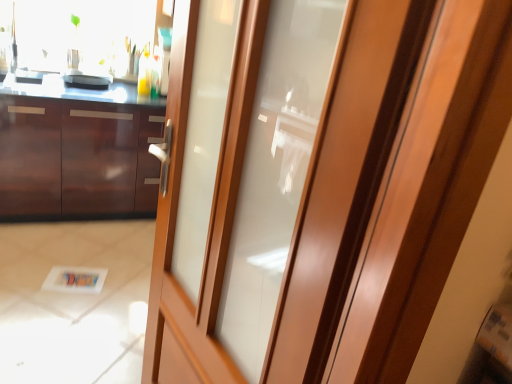
Question: Is glossy wood cabinetry at left facing away from matte black pan at upper left?

Choices:
 (A) yes
 (B) no

Answer: (B)

Question: From the image's perspective, is glossy wood cabinetry at left over matte black pan at upper left?

Choices:
 (A) no
 (B) yes

Answer: (A)

Question: Can you see glossy wood cabinetry at left touching matte black pan at upper left?

Choices:
 (A) yes
 (B) no

Answer: (B)

Question: From a real-world perspective, is glossy wood cabinetry at left below matte black pan at upper left?

Choices:
 (A) no
 (B) yes

Answer: (B)

Question: Does glossy wood cabinetry at left turn towards matte black pan at upper left?

Choices:
 (A) no
 (B) yes

Answer: (A)

Question: Looking at their shapes, would you say matte black pan at upper left is wider or thinner than matte wood door at center?

Choices:
 (A) thin
 (B) wide

Answer: (B)

Question: Is point (111, 76) positioned closer to the camera than point (345, 340)?

Choices:
 (A) farther
 (B) closer

Answer: (A)

Question: Relative to matte wood door at center, is matte black pan at upper left in front or behind?

Choices:
 (A) front
 (B) behind

Answer: (B)

Question: Would you say matte black pan at upper left is to the left or to the right of matte wood door at center in the picture?

Choices:
 (A) right
 (B) left

Answer: (B)

Question: Does point (123, 170) appear closer or farther from the camera than point (74, 87)?

Choices:
 (A) farther
 (B) closer

Answer: (A)

Question: From the image's perspective, is glossy wood cabinetry at left located above or below matte black pan at upper left?

Choices:
 (A) above
 (B) below

Answer: (B)

Question: Visually, is glossy wood cabinetry at left positioned to the left or to the right of matte black pan at upper left?

Choices:
 (A) right
 (B) left

Answer: (A)

Question: From a real-world perspective, relative to matte black pan at upper left, is glossy wood cabinetry at left vertically above or below?

Choices:
 (A) above
 (B) below

Answer: (B)

Question: From a real-world perspective, relative to glossy wood cabinetry at left, is matte black pan at upper left vertically above or below?

Choices:
 (A) below
 (B) above

Answer: (B)

Question: From the image's perspective, is matte black pan at upper left above or below glossy wood cabinetry at left?

Choices:
 (A) below
 (B) above

Answer: (B)